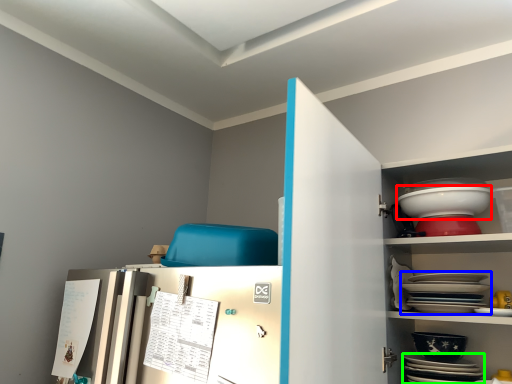
Question: Estimate the real-world distances between objects in this image. Which object is closer to bowl (highlighted by a red box), platter (highlighted by a blue box) or platter (highlighted by a green box)?

Choices:
 (A) platter
 (B) platter

Answer: (A)